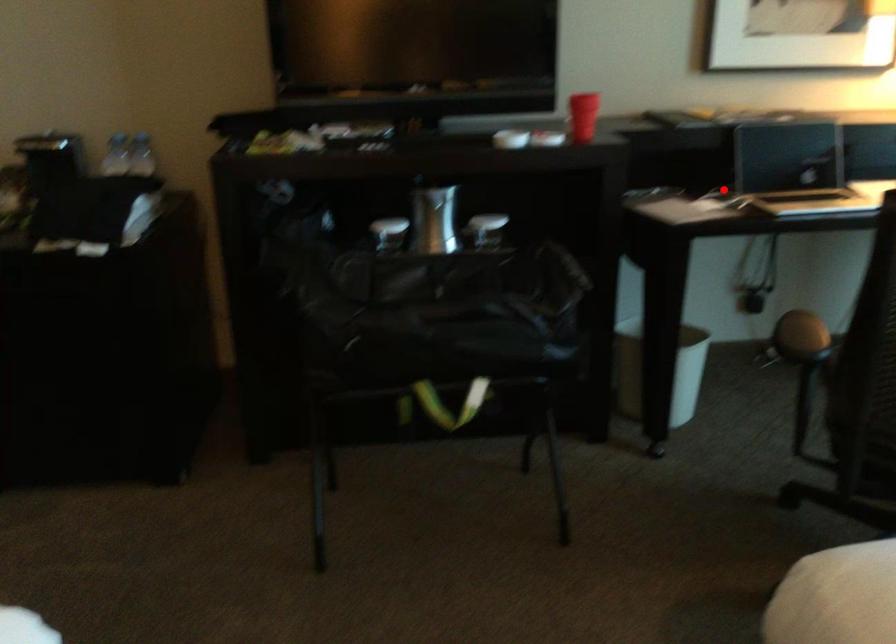
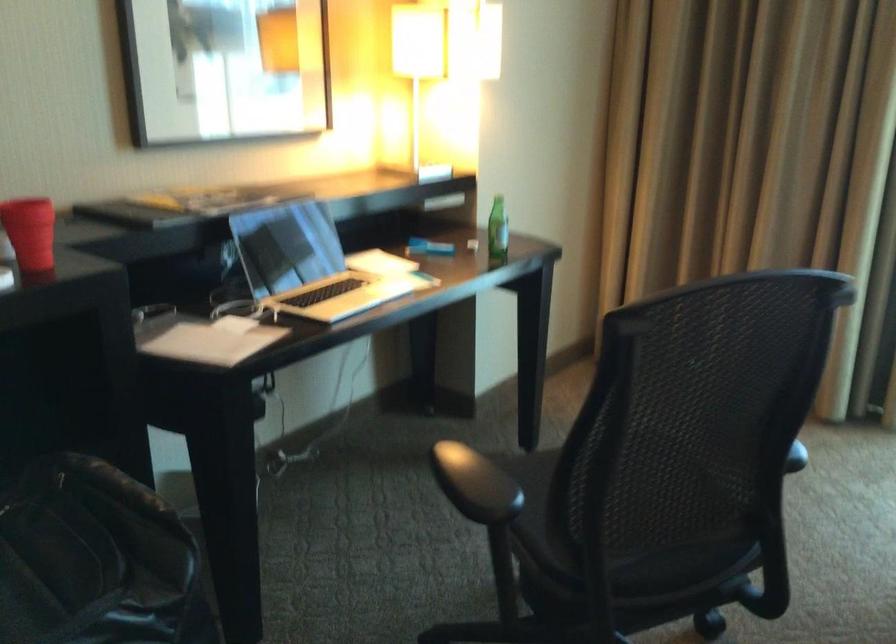
Question: I am providing you with two images of the same scene from different viewpoints. A red point is shown in image1. For the corresponding object point in image2, is it positioned nearer or farther from the camera?

Choices:
 (A) Nearer
 (B) Farther

Answer: (A)